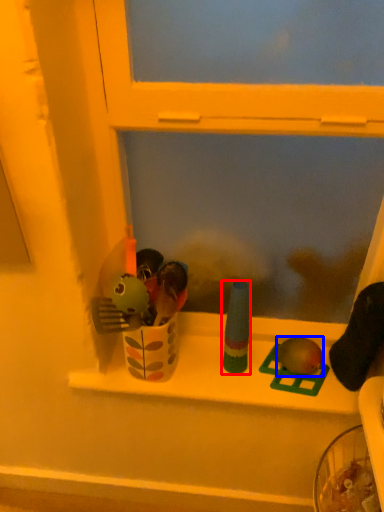
Question: Which object appears closest to the camera in this image, toy (highlighted by a red box) or toy (highlighted by a blue box)?

Choices:
 (A) toy
 (B) toy

Answer: (A)